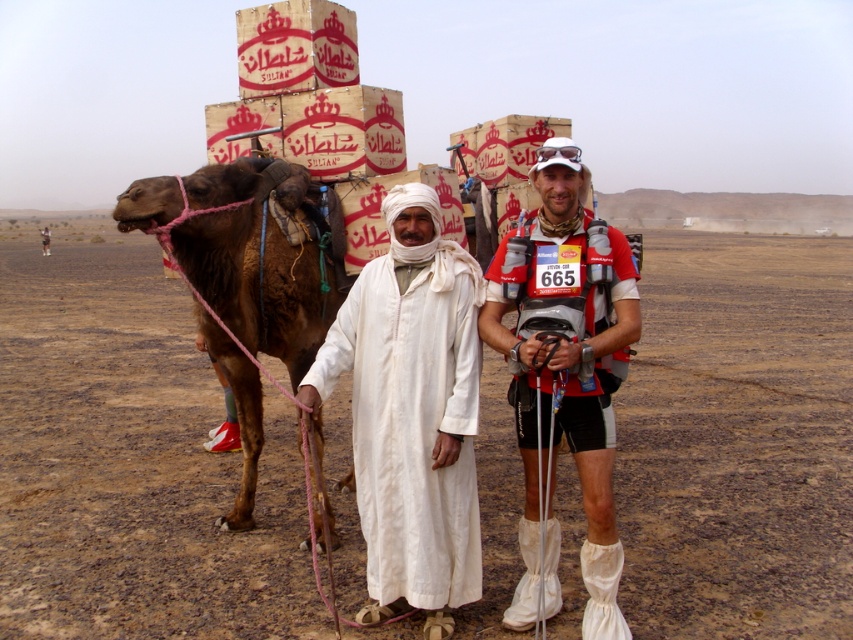
Question: Is matte red shirt at center further to the viewer compared to brown rough camel at left?

Choices:
 (A) no
 (B) yes

Answer: (A)

Question: Which point is farther to the camera?

Choices:
 (A) white cotton robe at center
 (B) matte red shirt at center

Answer: (A)

Question: Estimate the real-world distances between objects in this image. Which object is farther from the matte red shirt at center?

Choices:
 (A) white cotton clothing at center
 (B) white cotton robe at center
 (C) brown rough camel at left

Answer: (C)

Question: Does white cotton robe at center have a larger size compared to brown rough camel at left?

Choices:
 (A) yes
 (B) no

Answer: (B)

Question: In this image, where is white cotton clothing at center located relative to brown rough camel at left?

Choices:
 (A) below
 (B) above

Answer: (A)

Question: Which of these objects is positioned closest to the matte red shirt at center?

Choices:
 (A) white cotton clothing at center
 (B) brown rough camel at left
 (C) white cotton robe at center

Answer: (A)